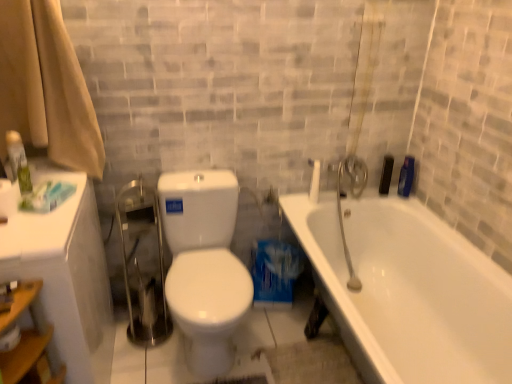
Question: Does white matte toilet paper at lower left turn towards white glossy bathtub at right?

Choices:
 (A) no
 (B) yes

Answer: (A)

Question: Is white matte toilet paper at lower left to the right of white glossy bathtub at right from the viewer's perspective?

Choices:
 (A) no
 (B) yes

Answer: (A)

Question: Does white matte toilet paper at lower left have a larger size compared to white glossy bathtub at right?

Choices:
 (A) yes
 (B) no

Answer: (B)

Question: From a real-world perspective, is white matte toilet paper at lower left located beneath white glossy bathtub at right?

Choices:
 (A) yes
 (B) no

Answer: (B)

Question: From the image's perspective, would you say white matte toilet paper at lower left is positioned over white glossy bathtub at right?

Choices:
 (A) no
 (B) yes

Answer: (B)

Question: Is blue glossy bottle at upper right, acting as the 2th toiletry starting from the back, in front of or behind green matte spray can at left, which is the 3th toiletry in right-to-left order, in the image?

Choices:
 (A) front
 (B) behind

Answer: (B)

Question: In terms of size, does blue glossy bottle at upper right, acting as the 2th toiletry starting from the back, appear bigger or smaller than green matte spray can at left, which is the 3th toiletry in right-to-left order?

Choices:
 (A) small
 (B) big

Answer: (B)

Question: Is blue glossy bottle at upper right, the third toiletry from the left, wider or thinner than green matte spray can at left, which is the 3th toiletry in right-to-left order?

Choices:
 (A) wide
 (B) thin

Answer: (A)

Question: Does point (403, 185) appear closer or farther from the camera than point (16, 175)?

Choices:
 (A) closer
 (B) farther

Answer: (B)

Question: Considering the positions of point (414, 256) and point (66, 69), is point (414, 256) closer or farther from the camera than point (66, 69)?

Choices:
 (A) closer
 (B) farther

Answer: (B)

Question: Relative to beige fabric shower curtain at left, is white glossy bathtub at right in front or behind?

Choices:
 (A) front
 (B) behind

Answer: (A)

Question: Is white glossy bathtub at right to the left or to the right of beige fabric shower curtain at left in the image?

Choices:
 (A) right
 (B) left

Answer: (A)

Question: Considering the positions of white glossy bathtub at right and beige fabric shower curtain at left in the image, is white glossy bathtub at right wider or thinner than beige fabric shower curtain at left?

Choices:
 (A) thin
 (B) wide

Answer: (B)

Question: In terms of width, does green matte spray can at left, which appears as the first toiletry when viewed from the front, look wider or thinner when compared to beige fabric shower curtain at left?

Choices:
 (A) thin
 (B) wide

Answer: (A)

Question: Is green matte spray can at left, the 3th toiletry when ordered from back to front, to the left or to the right of beige fabric shower curtain at left in the image?

Choices:
 (A) left
 (B) right

Answer: (A)